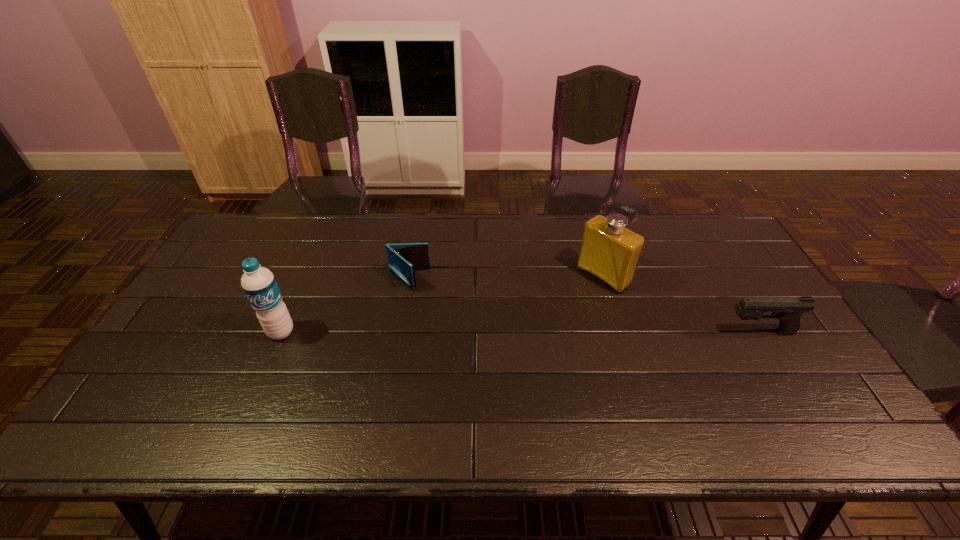
What are the coordinates of `free spot on the desktop that is between the water bottle and the third tallest object and is positioned on the exterior surface of the shortest object` in the screenshot? It's located at (473, 332).

The height and width of the screenshot is (540, 960). I want to click on free space on the desktop that is between the water bottle and the pistol and is positioned on the front-facing side of the third object from left to right, so click(x=530, y=332).